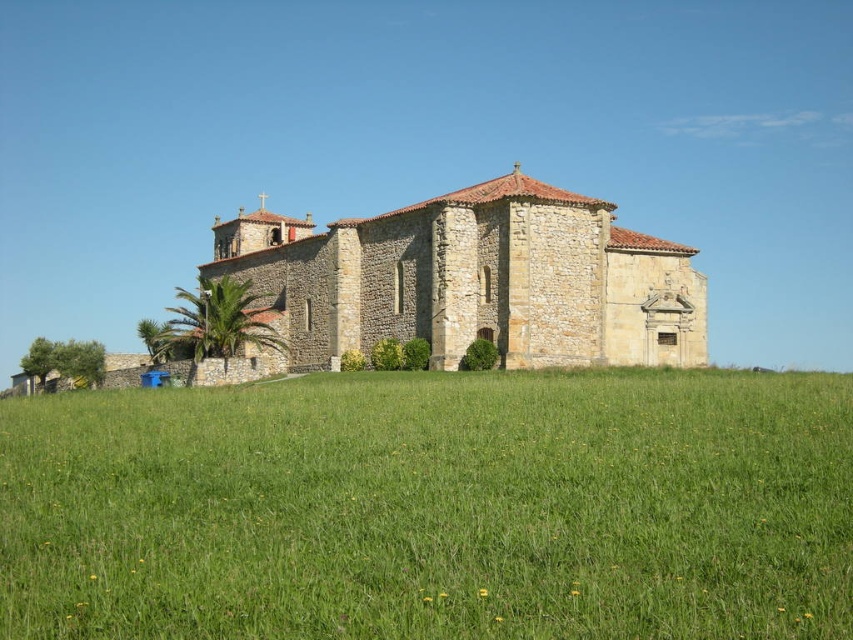
Question: Can you confirm if green grass at lower center is positioned to the left of stone church at center?

Choices:
 (A) yes
 (B) no

Answer: (B)

Question: Is green grass at lower center to the left of stone church at center from the viewer's perspective?

Choices:
 (A) no
 (B) yes

Answer: (A)

Question: Which point appears closest to the camera in this image?

Choices:
 (A) (372, 458)
 (B) (498, 314)

Answer: (A)

Question: Can you confirm if green grass at lower center is positioned above stone church at center?

Choices:
 (A) yes
 (B) no

Answer: (B)

Question: Which point is farther to the camera?

Choices:
 (A) green grass at lower center
 (B) stone church at center

Answer: (B)

Question: Which point is closer to the camera?

Choices:
 (A) green grass at lower center
 (B) stone church at center

Answer: (A)